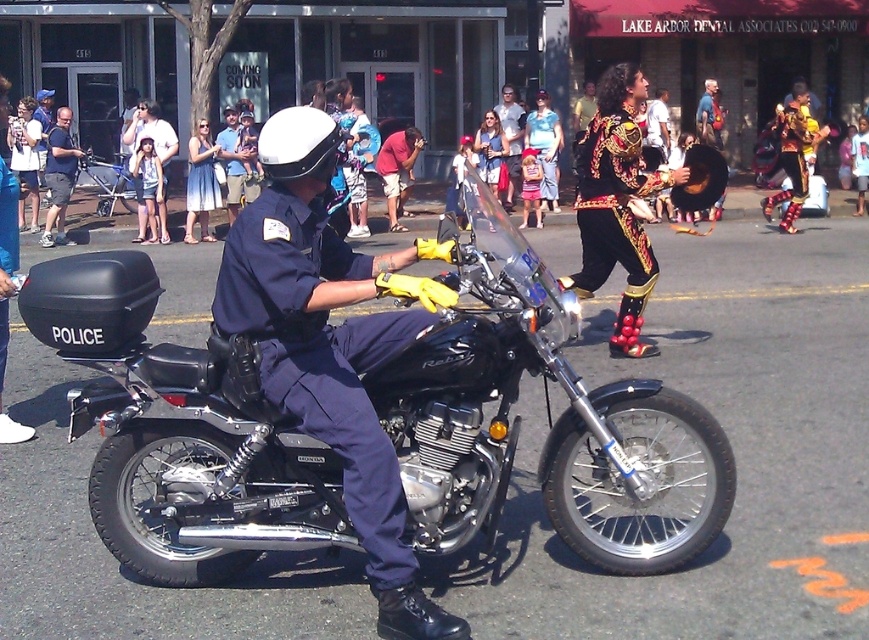
Question: Which of the following is the closest to the observer?

Choices:
 (A) (631, 145)
 (B) (329, 403)
 (C) (503, 243)
 (D) (501, 122)

Answer: (B)

Question: Observing the image, what is the correct spatial positioning of navy blue uniform at center in reference to blue cotton dress at upper left?

Choices:
 (A) above
 (B) below

Answer: (B)

Question: Among these objects, which one is nearest to the camera?

Choices:
 (A) black matte police motorcycle at center
 (B) black velvet costume at center

Answer: (A)

Question: Which point is closer to the camera taking this photo?

Choices:
 (A) (191, 196)
 (B) (150, 193)

Answer: (B)

Question: Does black matte police motorcycle at center have a greater width compared to blue cotton dress at upper left?

Choices:
 (A) yes
 (B) no

Answer: (A)

Question: Can you confirm if black matte police motorcycle at center is positioned above dark blue fabric uniform at left?

Choices:
 (A) no
 (B) yes

Answer: (A)